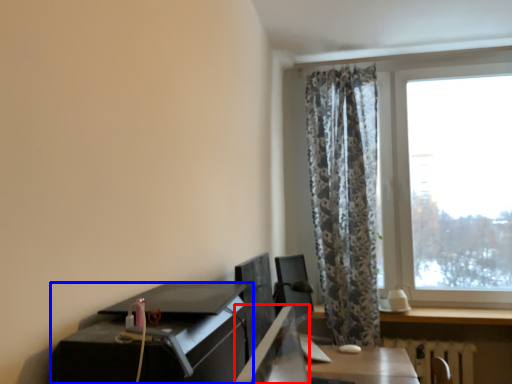
Question: Which of the following is the closest to the observer, desktop (highlighted by a red box) or desk (highlighted by a blue box)?

Choices:
 (A) desktop
 (B) desk

Answer: (A)